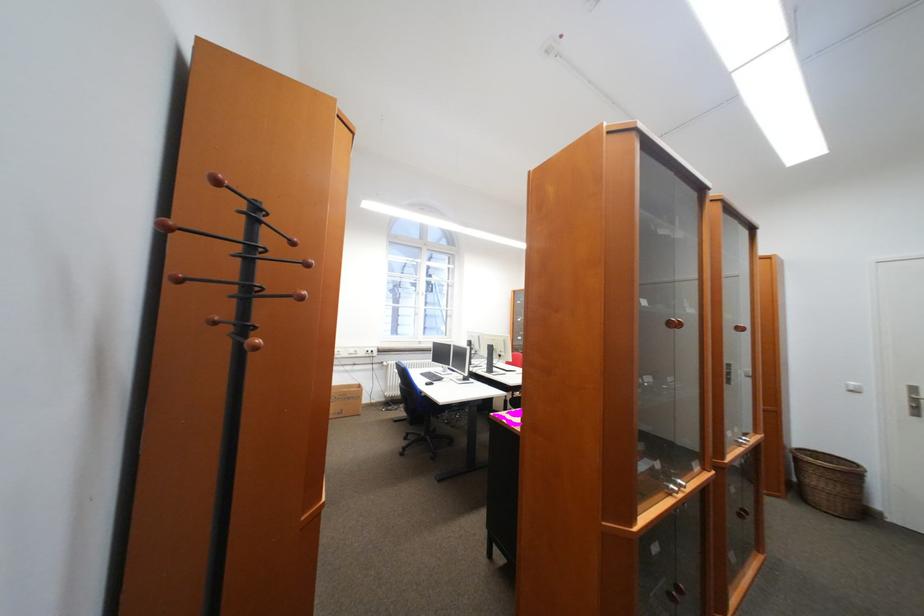
Where is `metal door handle`? This screenshot has height=616, width=924. metal door handle is located at coordinates (915, 400).